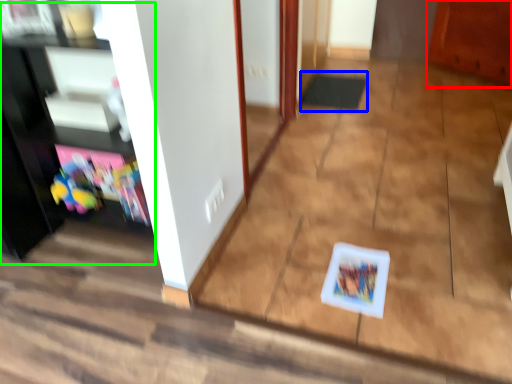
Question: Which is farther away from cabinetry (highlighted by a red box)? doormat (highlighted by a blue box) or entertainment center (highlighted by a green box)?

Choices:
 (A) doormat
 (B) entertainment center

Answer: (B)